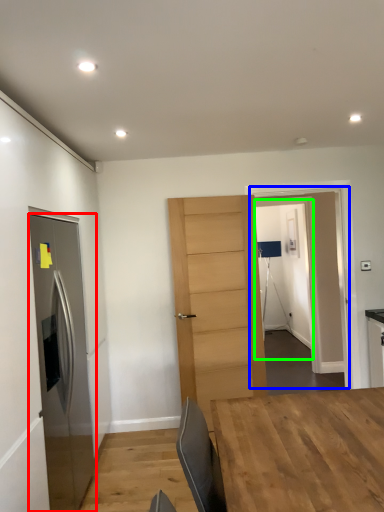
Question: Based on their relative distances, which object is farther from door (highlighted by a red box)? Choose from glass door (highlighted by a blue box) and glass door (highlighted by a green box).

Choices:
 (A) glass door
 (B) glass door

Answer: (B)